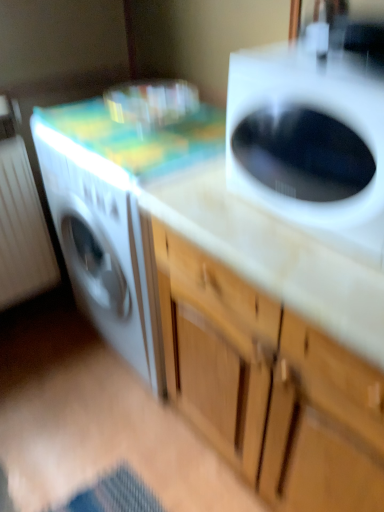
Question: Is point (369, 257) positioned closer to the camera than point (264, 389)?

Choices:
 (A) farther
 (B) closer

Answer: (B)

Question: From a real-world perspective, relative to wooden cabinet at center, is white glossy washing machine at upper right vertically above or below?

Choices:
 (A) above
 (B) below

Answer: (A)

Question: Is white glossy washing machine at upper right in front of or behind wooden cabinet at center in the image?

Choices:
 (A) behind
 (B) front

Answer: (A)

Question: In the image, is wooden cabinet at center on the left side or the right side of white glossy washing machine at upper right?

Choices:
 (A) left
 (B) right

Answer: (B)

Question: From a real-world perspective, relative to white glossy washing machine at upper right, is wooden cabinet at center vertically above or below?

Choices:
 (A) above
 (B) below

Answer: (B)

Question: Which is correct: wooden cabinet at center is inside white glossy washing machine at upper right, or outside of it?

Choices:
 (A) outside
 (B) inside

Answer: (A)

Question: From the image's perspective, is wooden cabinet at center located above or below white glossy washing machine at upper right?

Choices:
 (A) above
 (B) below

Answer: (B)